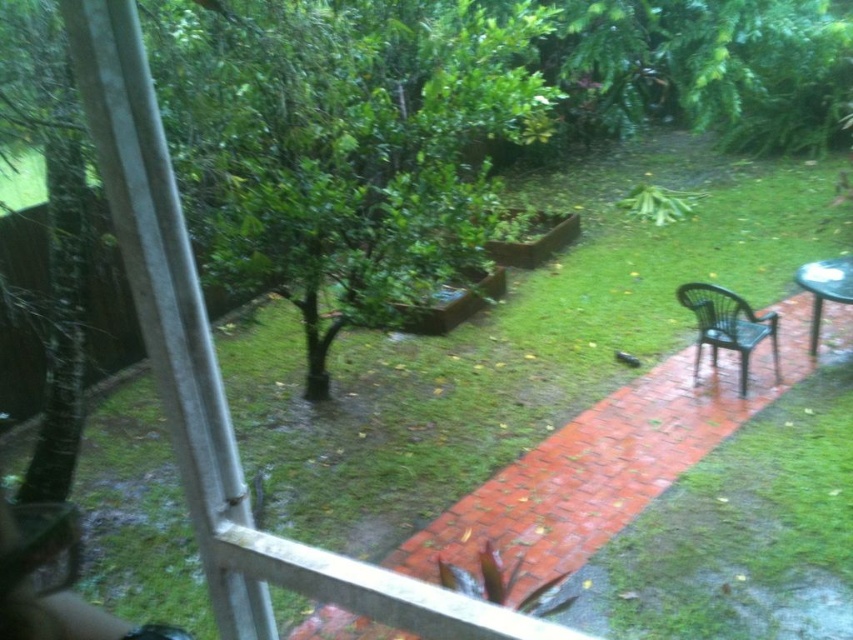
Question: Does black plastic chair at right appear on the right side of metallic silver table at right?

Choices:
 (A) yes
 (B) no

Answer: (B)

Question: Which point appears farthest from the camera in this image?

Choices:
 (A) 755,340
 (B) 817,298

Answer: (B)

Question: Is black plastic chair at right bigger than metallic silver table at right?

Choices:
 (A) no
 (B) yes

Answer: (B)

Question: Which point is closer to the camera?

Choices:
 (A) (704, 289)
 (B) (811, 260)

Answer: (A)

Question: Does black plastic chair at right appear on the left side of metallic silver table at right?

Choices:
 (A) yes
 (B) no

Answer: (A)